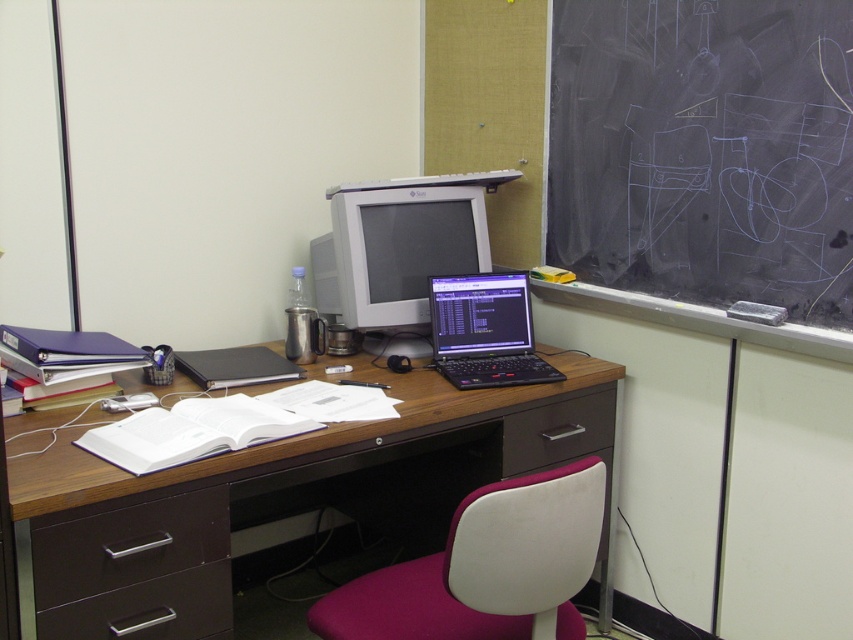
Based on the photo, you are setting up a new monitor stand that requires knowing the height difference between the matte gray monitor at center and the black matte laptop at center. According to the scene description, which one is taller?

The matte gray monitor at center is taller than the black matte laptop at center.

You are a student trying to write on the black chalkboard at upper right but you need to move the matte black laptop at center first. Is the laptop blocking the chalkboard?

The black chalkboard at upper right is positioned over matte black laptop at center, meaning the laptop is underneath the chalkboard and not blocking it. Therefore, you don not need to move the laptop to write on the chalkboard.

You are organizing the desk and need to move the matte black laptop at center and the dark brown wood drawer at lower center. Which object is located to the left of the other?

The matte black laptop at center is positioned on the left side of dark brown wood drawer at lower center.